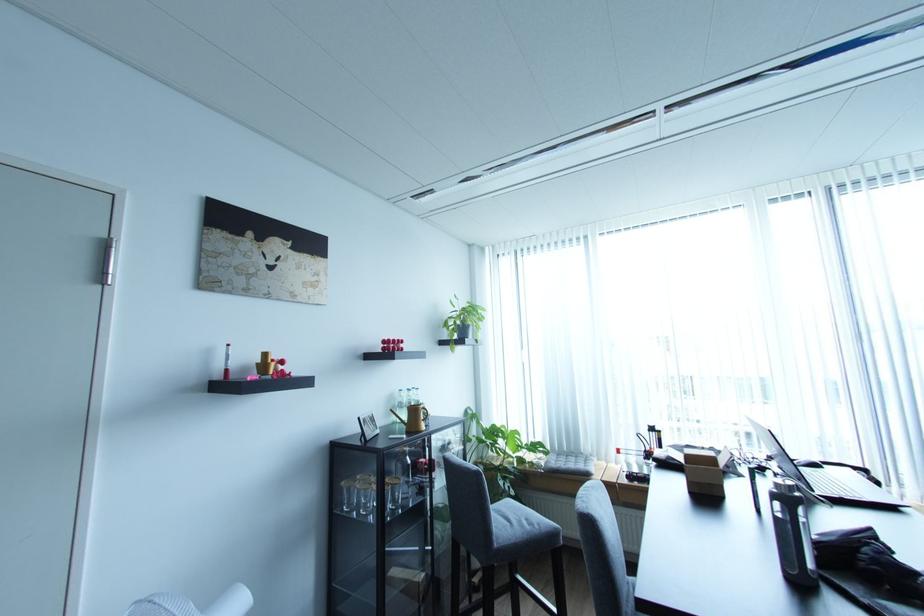
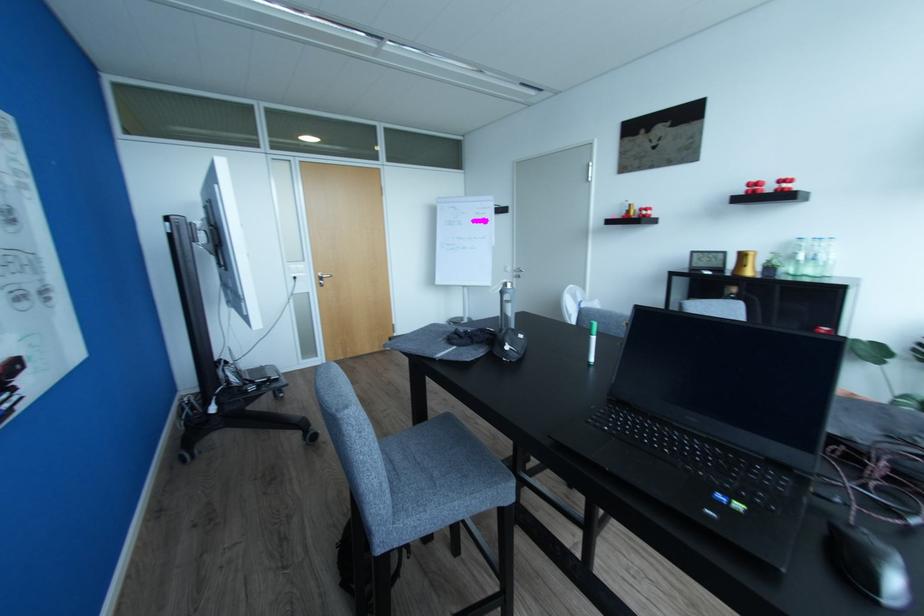
Locate, in the second image, the point that corresponds to the point at 405,339 in the first image.

(791, 177)